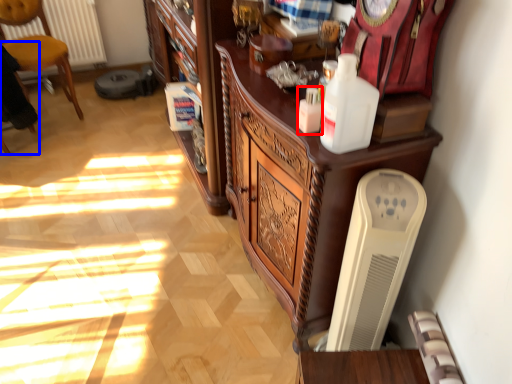
Question: Which object is further to the camera taking this photo, bottle (highlighted by a red box) or armchair (highlighted by a blue box)?

Choices:
 (A) bottle
 (B) armchair

Answer: (B)